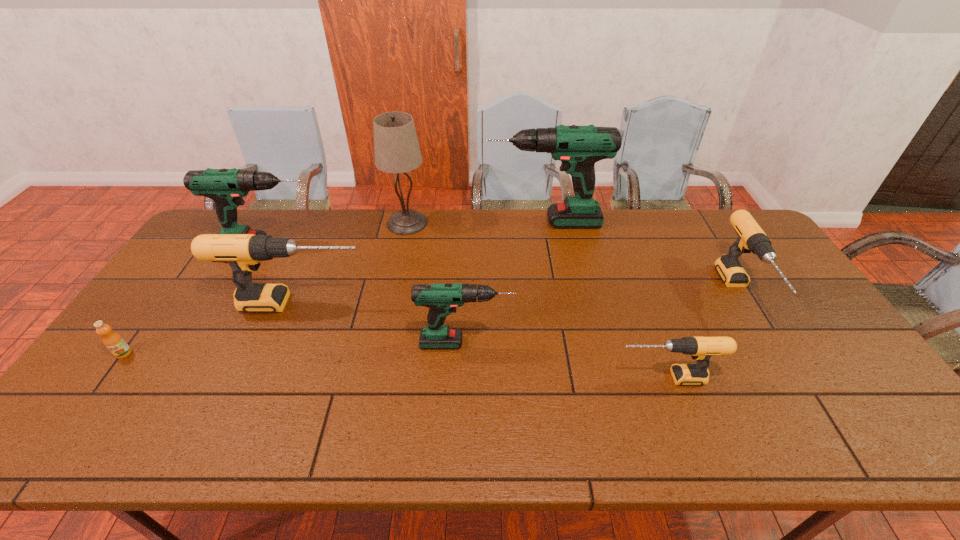
This screenshot has height=540, width=960. What are the coordinates of `the second black drill from right to left` in the screenshot? It's located at (701, 349).

The height and width of the screenshot is (540, 960). I want to click on the leftmost object, so click(113, 341).

In order to click on the shortest object in this screenshot , I will do tap(113, 341).

Find the location of a particular element. Image resolution: width=960 pixels, height=540 pixels. free space located on the front-facing side of the lampshade is located at coordinates (401, 253).

Where is `free point located 0.350m on the handle side of the biggest green drill`? This screenshot has height=540, width=960. free point located 0.350m on the handle side of the biggest green drill is located at coordinates (387, 222).

Find the location of a particular element. This screenshot has height=540, width=960. free space located on the handle side of the biggest green drill is located at coordinates (443, 222).

The image size is (960, 540). In order to click on vacant space located on the handle side of the biggest green drill in this screenshot , I will do `click(410, 222)`.

At what (x,y) coordinates should I click in order to perform the action: click on free region located on the handle side of the third farthest object. Please return your answer as a coordinate pair (x, y). Image resolution: width=960 pixels, height=540 pixels. Looking at the image, I should click on (415, 246).

Where is `free spot located 0.170m on the handle side of the biggest black drill`? This screenshot has height=540, width=960. free spot located 0.170m on the handle side of the biggest black drill is located at coordinates (426, 303).

Where is `vacant area situated on the handle side of the nearest green drill`? vacant area situated on the handle side of the nearest green drill is located at coordinates (580, 343).